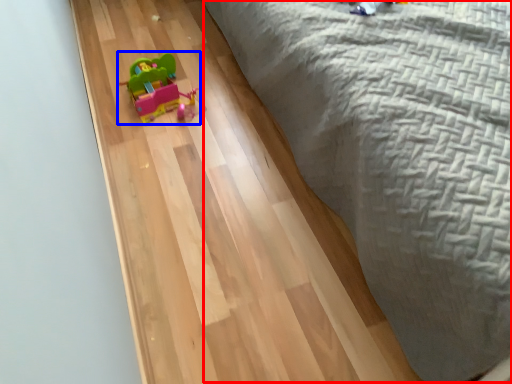
Question: Among these objects, which one is nearest to the camera, bed (highlighted by a red box) or toy (highlighted by a blue box)?

Choices:
 (A) bed
 (B) toy

Answer: (A)